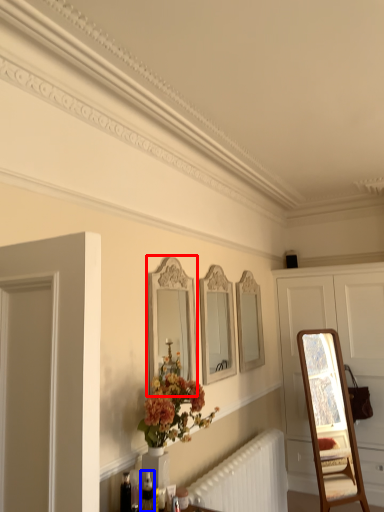
Question: Which point is closer to the camera, mirror (highlighted by a red box) or toiletry (highlighted by a blue box)?

Choices:
 (A) mirror
 (B) toiletry

Answer: (B)